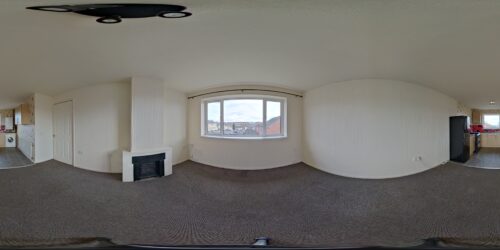
The height and width of the screenshot is (250, 500). I want to click on room corners, so click(x=194, y=153), click(x=187, y=126), click(x=303, y=150), click(x=50, y=152), click(x=15, y=147), click(x=476, y=150).